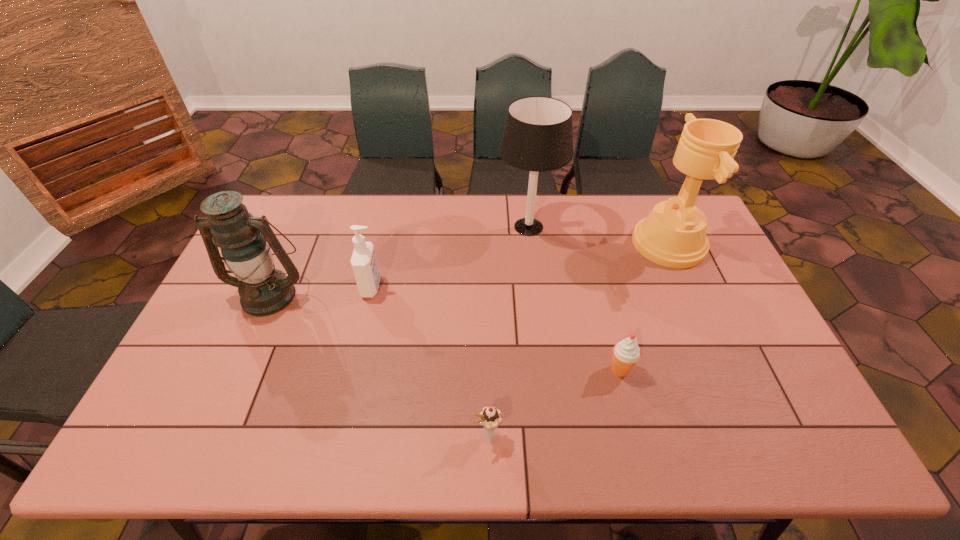
Find the location of a particular element. free space located on the back of the award is located at coordinates (651, 205).

At what (x,y) coordinates should I click in order to perform the action: click on free region located 0.190m on the front of the leftmost object. Please return your answer as a coordinate pair (x, y). Looking at the image, I should click on (234, 374).

At what (x,y) coordinates should I click in order to perform the action: click on vacant space located on the front label of the fifth object from right to left. Please return your answer as a coordinate pair (x, y). Looking at the image, I should click on [445, 287].

Find the location of a particular element. The image size is (960, 540). free space located 0.290m on the right of the right icecream is located at coordinates (742, 370).

In order to click on free location located 0.150m on the right of the nearest object in this screenshot , I will do `click(565, 435)`.

What are the coordinates of `table lamp that is at the far edge` in the screenshot? It's located at tap(538, 136).

Where is `award at the far edge`? award at the far edge is located at coordinates (673, 235).

Where is `object at the near edge`? Image resolution: width=960 pixels, height=540 pixels. object at the near edge is located at coordinates (490, 417).

Find the location of `object positioned at the left edge`. object positioned at the left edge is located at coordinates (263, 291).

At what (x,y) coordinates should I click in order to perform the action: click on object that is at the right edge. Please return your answer as a coordinate pair (x, y). This screenshot has height=540, width=960. Looking at the image, I should click on (673, 235).